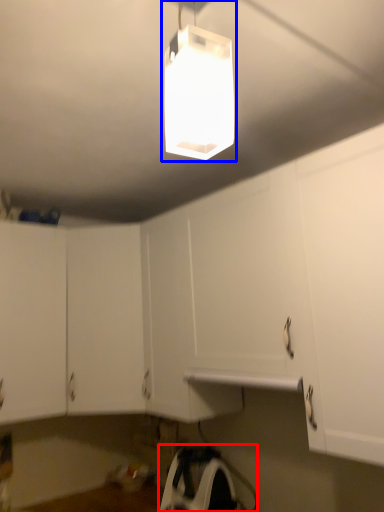
Question: Which of the following is the closest to the observer, appliance (highlighted by a red box) or lamp (highlighted by a blue box)?

Choices:
 (A) appliance
 (B) lamp

Answer: (B)